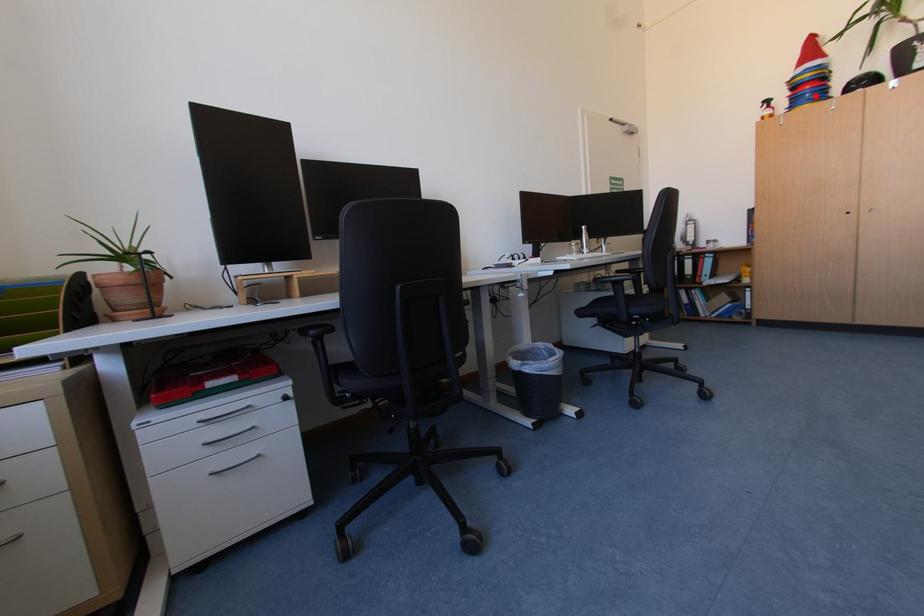
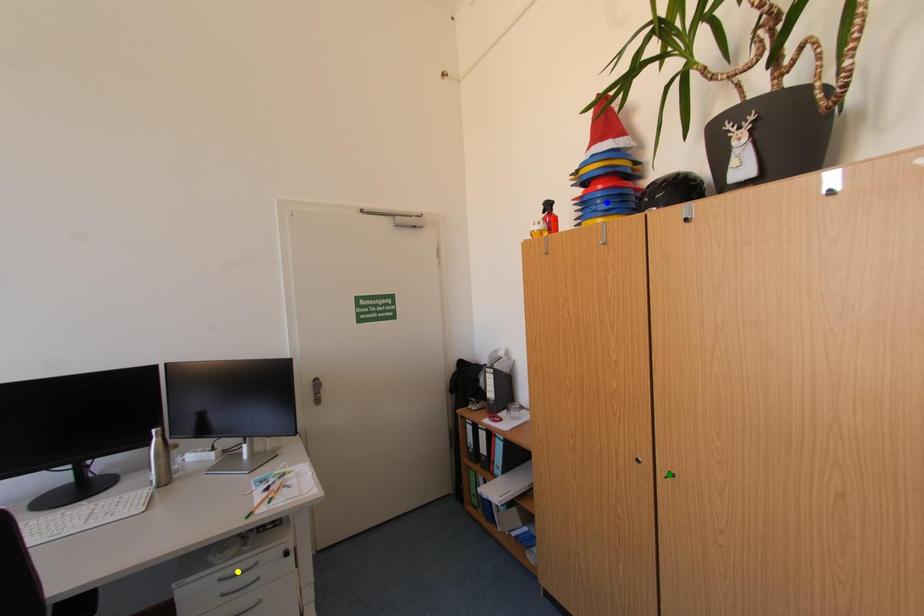
Question: I am providing you with two images of the same scene from different viewpoints. A red point is marked on the first image. You are given multiple points on the second image. Can you choose the point in image 2 that corresponds to the point in image 1?

Choices:
 (A) yellow point
 (B) green point
 (C) blue point

Answer: (C)